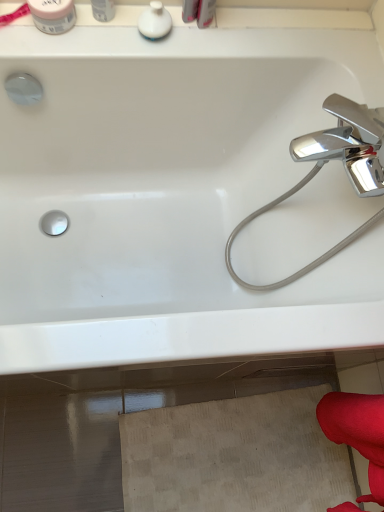
Question: Considering the relative sizes of white glossy container at upper left, placed as the 2th toiletry when sorted from left to right, and white glossy bathtub at upper center in the image provided, is white glossy container at upper left, placed as the 2th toiletry when sorted from left to right, smaller than white glossy bathtub at upper center?

Choices:
 (A) yes
 (B) no

Answer: (A)

Question: Is white glossy container at upper left, acting as the 2th toiletry starting from the right, facing towards white glossy bathtub at upper center?

Choices:
 (A) no
 (B) yes

Answer: (A)

Question: Is white glossy bathtub at upper center located within white glossy container at upper left, placed as the 2th toiletry when sorted from left to right?

Choices:
 (A) no
 (B) yes

Answer: (A)

Question: Is white glossy container at upper left, placed as the 2th toiletry when sorted from left to right, not inside white glossy bathtub at upper center?

Choices:
 (A) yes
 (B) no

Answer: (A)

Question: Does white glossy container at upper left, acting as the 2th toiletry starting from the right, have a greater width compared to white glossy bathtub at upper center?

Choices:
 (A) yes
 (B) no

Answer: (B)

Question: Does white glossy container at upper left, acting as the 2th toiletry starting from the right, have a greater height compared to white glossy bathtub at upper center?

Choices:
 (A) yes
 (B) no

Answer: (B)

Question: Is white glossy soap dispenser at upper center, which ranks as the first toiletry in right-to-left order, not within white matte jar at upper left, the 1th toiletry positioned from the left?

Choices:
 (A) no
 (B) yes

Answer: (B)

Question: Can you confirm if white glossy soap dispenser at upper center, the third toiletry in the left-to-right sequence, is thinner than white matte jar at upper left, the 3th toiletry viewed from the right?

Choices:
 (A) yes
 (B) no

Answer: (A)

Question: Considering the relative positions of white glossy soap dispenser at upper center, the third toiletry in the left-to-right sequence, and white matte jar at upper left, the 3th toiletry viewed from the right, in the image provided, is white glossy soap dispenser at upper center, the third toiletry in the left-to-right sequence, behind white matte jar at upper left, the 3th toiletry viewed from the right,?

Choices:
 (A) no
 (B) yes

Answer: (B)

Question: Is white glossy soap dispenser at upper center, which ranks as the first toiletry in right-to-left order, directly adjacent to white matte jar at upper left, the 3th toiletry viewed from the right?

Choices:
 (A) yes
 (B) no

Answer: (B)

Question: Is white glossy soap dispenser at upper center, the third toiletry in the left-to-right sequence, wider than white matte jar at upper left, the 3th toiletry viewed from the right?

Choices:
 (A) no
 (B) yes

Answer: (A)

Question: Does white glossy soap dispenser at upper center, the third toiletry in the left-to-right sequence, have a lesser height compared to white matte jar at upper left, the 3th toiletry viewed from the right?

Choices:
 (A) yes
 (B) no

Answer: (A)

Question: Is white glossy bathtub at upper center a part of white glossy soap dispenser at upper center, which ranks as the first toiletry in right-to-left order?

Choices:
 (A) yes
 (B) no

Answer: (B)